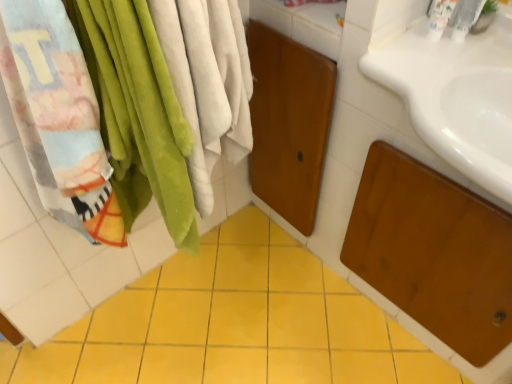
Locate an element on the screen. free point in front of white plastic bottle at upper right, positioned as the second toiletry in right-to-left order is located at coordinates (433, 74).